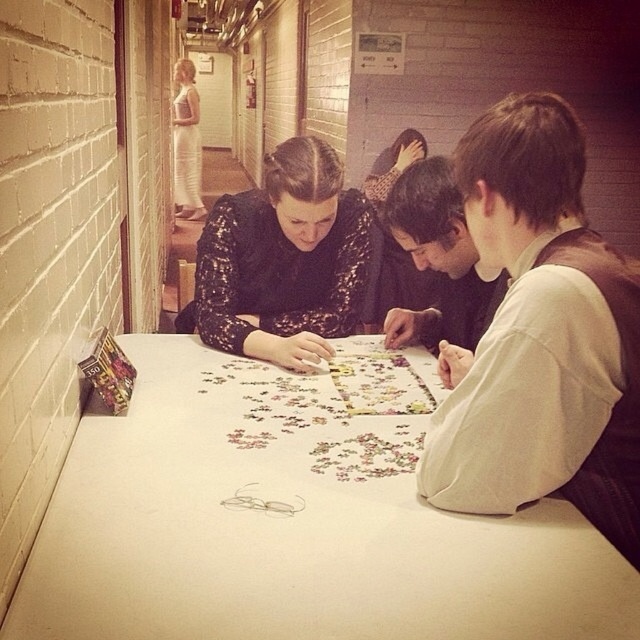
You are standing in the hallway where the puzzle is being assembled. There is a point marked at coordinates (438, 259) which corresponds to an object in the scene. What object is located at this coordinate?

The point at coordinates (438, 259) corresponds to the dark brown hair at center.

You are a person with a height of 1.63 meters. You want to stand between the black sequined dress at center and the puzzle table. Is there enough space for you to stand there?

The distance between the black sequined dress at center and the puzzle table is 1.63 meters, so yes, there is enough space for you to stand between them since your height is equal to the distance.